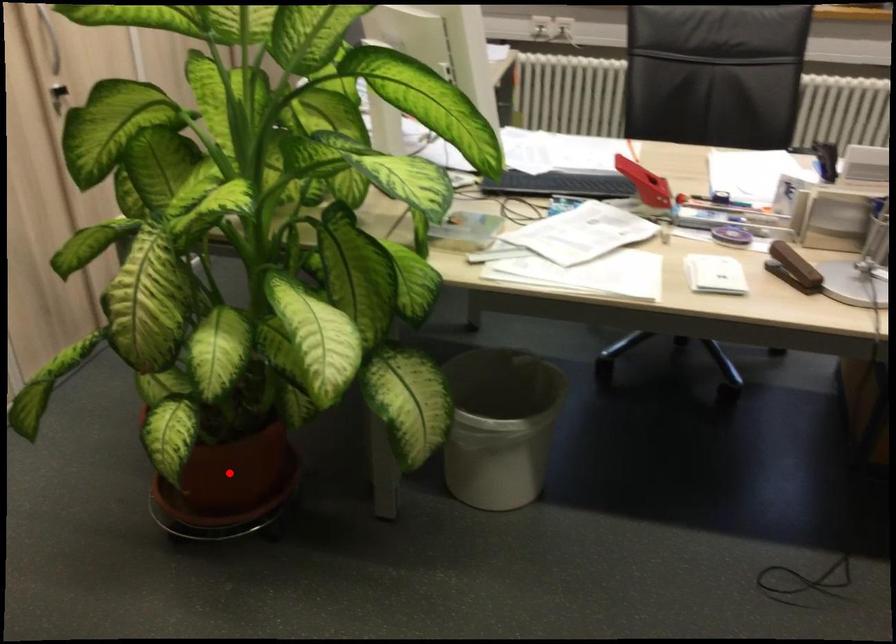
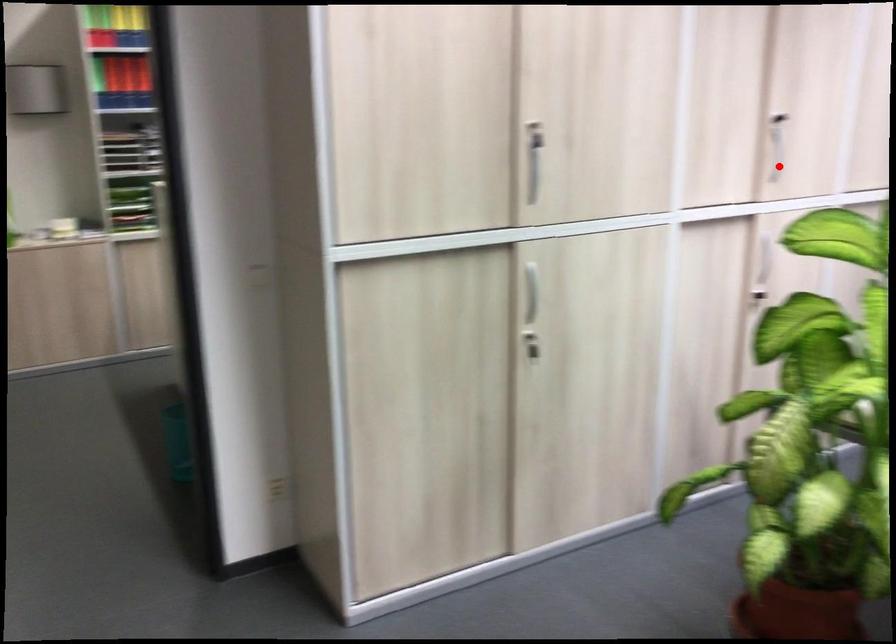
I am providing you with two images of the same scene from different viewpoints. A red point is marked on the first image and another point is marked on the second image. Are the points marked in image1 and image2 representing the same 3D position?

No